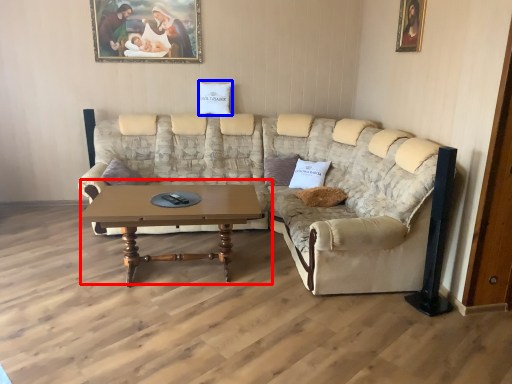
Question: Which object appears farthest to the camera in this image, coffee table (highlighted by a red box) or pillow (highlighted by a blue box)?

Choices:
 (A) coffee table
 (B) pillow

Answer: (B)